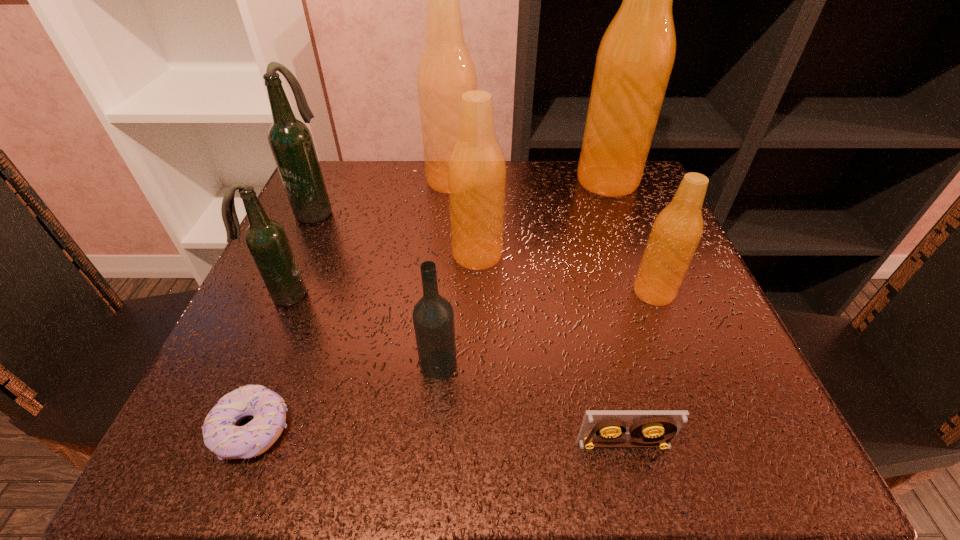
At what (x,y) coordinates should I click in order to perform the action: click on the biggest tan beer bottle. Please return your answer as a coordinate pair (x, y). This screenshot has height=540, width=960. Looking at the image, I should click on pyautogui.click(x=636, y=55).

The height and width of the screenshot is (540, 960). Find the location of `the tallest beer bottle`. the tallest beer bottle is located at coordinates (636, 55).

Find the location of `the third smallest tan beer bottle`. the third smallest tan beer bottle is located at coordinates (446, 70).

Locate an element on the screen. The height and width of the screenshot is (540, 960). the eighth shortest object is located at coordinates (446, 70).

This screenshot has width=960, height=540. Identify the location of the third farthest tan beer bottle. (476, 168).

Where is `the fourth farthest object`? This screenshot has height=540, width=960. the fourth farthest object is located at coordinates (476, 168).

Where is `the farther dark beer bottle`? The image size is (960, 540). the farther dark beer bottle is located at coordinates (290, 140).

At what (x,y) coordinates should I click in order to perform the action: click on the nearest tan beer bottle. Please return your answer as a coordinate pair (x, y). The width and height of the screenshot is (960, 540). Looking at the image, I should click on (676, 232).

Where is `the smaller dark beer bottle`? the smaller dark beer bottle is located at coordinates click(266, 239).

Identify the location of vodka. (433, 317).